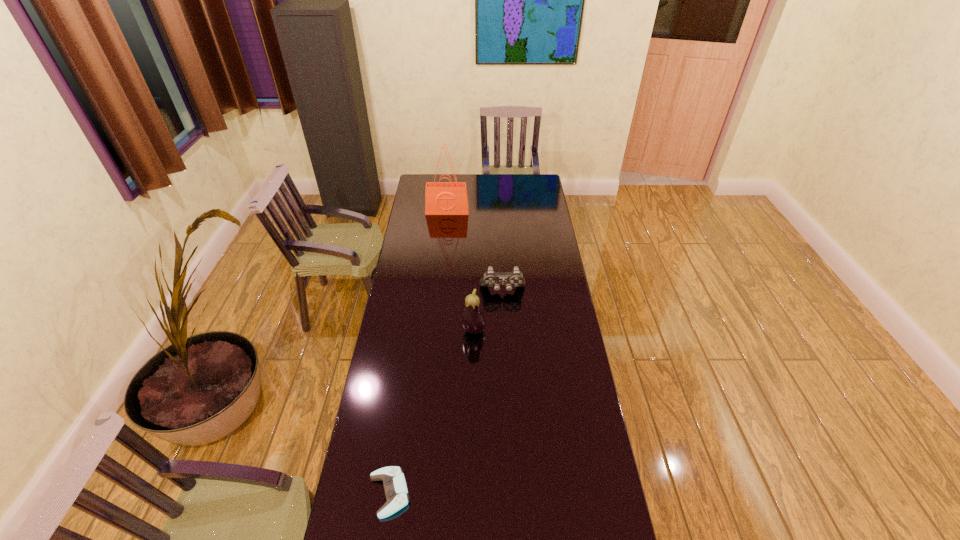
I want to click on vacant area that lies between the right control and the farthest object, so click(475, 251).

This screenshot has width=960, height=540. In order to click on free space between the eggplant and the farther control in this screenshot , I will do `click(488, 310)`.

The height and width of the screenshot is (540, 960). I want to click on unoccupied area between the tote bag and the third shortest object, so click(461, 271).

Where is `vacant space that's between the third tallest object and the eggplant`? This screenshot has width=960, height=540. vacant space that's between the third tallest object and the eggplant is located at coordinates (488, 310).

I want to click on free spot between the farther control and the second nearest object, so click(x=488, y=310).

The image size is (960, 540). I want to click on free space between the tallest object and the second shortest object, so click(x=475, y=251).

Find the location of a particular element. The image size is (960, 540). free spot between the shorter control and the eggplant is located at coordinates (432, 412).

Locate an element on the screen. free space that is in between the second nearest object and the taller control is located at coordinates (488, 310).

The width and height of the screenshot is (960, 540). Find the location of `the second closest object relative to the tallest object`. the second closest object relative to the tallest object is located at coordinates (473, 321).

The image size is (960, 540). Find the location of `object that can be found as the second closest to the nearer control`. object that can be found as the second closest to the nearer control is located at coordinates (515, 278).